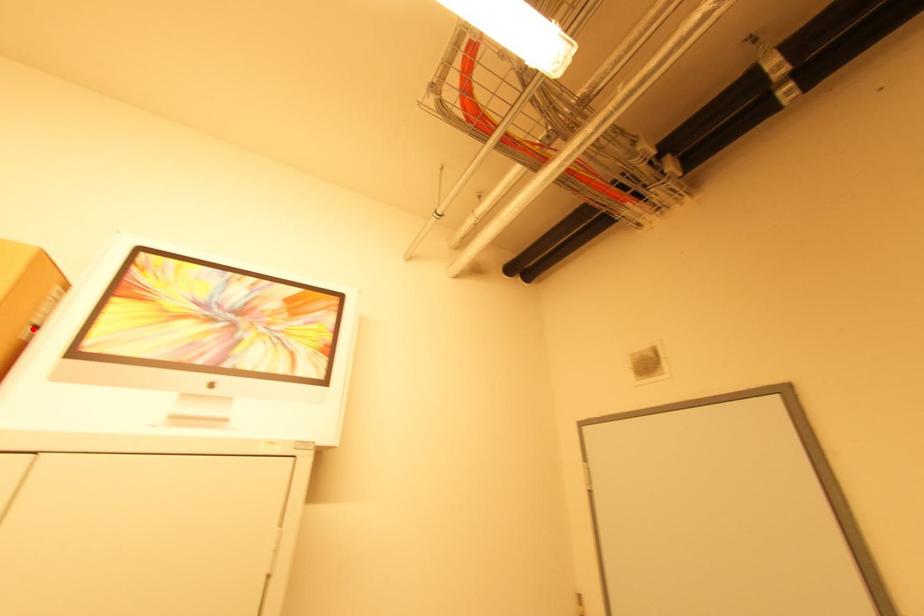
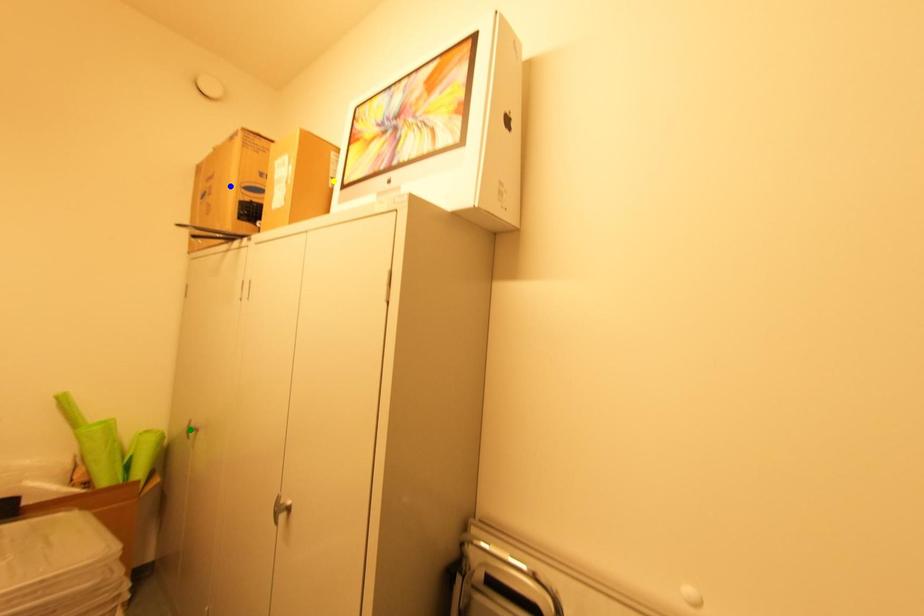
Question: I am providing you with two images of the same scene from different viewpoints. A red point is marked on the first image. You are given multiple points on the second image. Which point in image 2 represents the same 3d spot as the red point in image 1?

Choices:
 (A) blue point
 (B) yellow point
 (C) green point

Answer: (B)